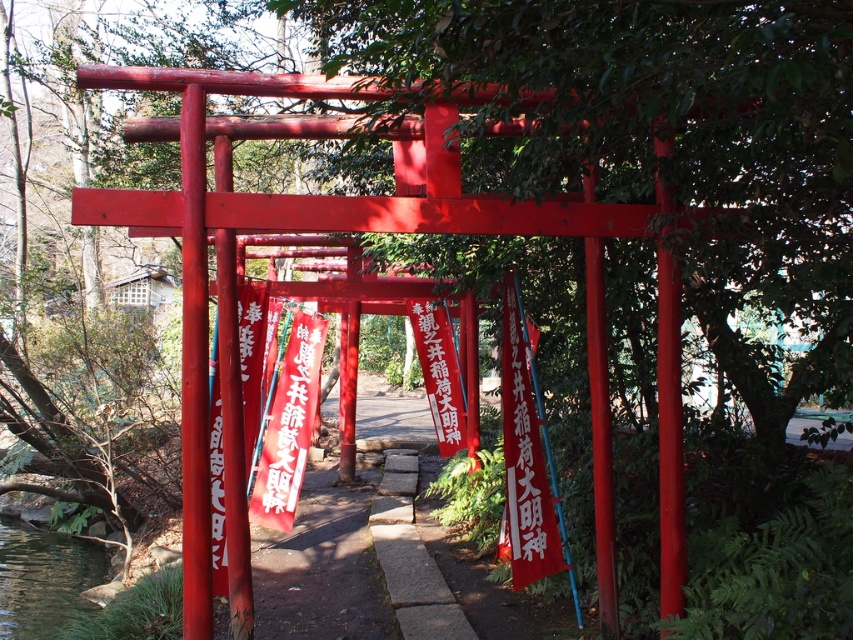
Question: Which of the following is the closest to the observer?

Choices:
 (A) (456, 396)
 (B) (13, 580)

Answer: (B)

Question: Which object is closer to the camera taking this photo?

Choices:
 (A) red paper banner at center
 (B) clear water at lower left

Answer: (B)

Question: From the image, what is the correct spatial relationship of clear water at lower left in relation to red paper banner at center?

Choices:
 (A) right
 (B) left

Answer: (B)

Question: Which point is closer to the camera?

Choices:
 (A) red paper banner at center
 (B) clear water at lower left

Answer: (B)

Question: Can you confirm if clear water at lower left is thinner than red paper banner at center?

Choices:
 (A) no
 (B) yes

Answer: (A)

Question: Can you confirm if clear water at lower left is positioned below red paper banner at center?

Choices:
 (A) no
 (B) yes

Answer: (B)